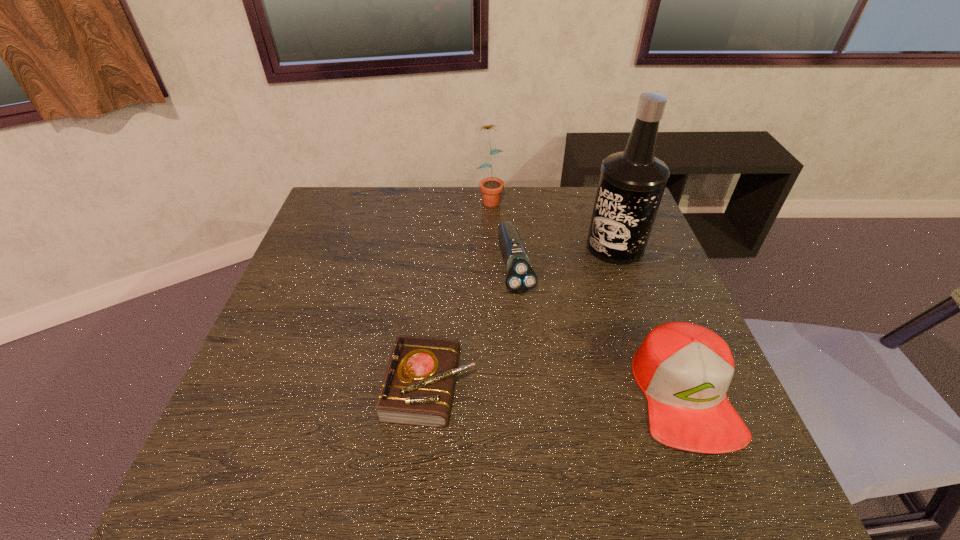
The width and height of the screenshot is (960, 540). I want to click on vacant space on the desktop that is between the shortest object and the baseball cap and is positioned on the front label of the tallest object, so pyautogui.click(x=537, y=389).

Find the location of a particular element. The height and width of the screenshot is (540, 960). vacant space on the desktop that is between the diary and the baseball cap and is positioned on the flower of the second tallest object is located at coordinates (577, 391).

Where is `vacant space on the desktop that is between the shortest object and the baseball cap and is positioned on the head of the electric shaver`? vacant space on the desktop that is between the shortest object and the baseball cap and is positioned on the head of the electric shaver is located at coordinates (554, 390).